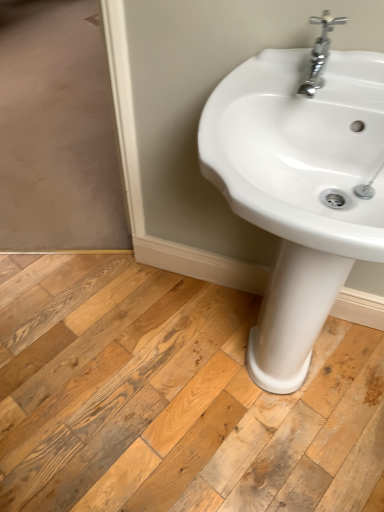
Question: Is chrome metallic faucet at upper right to the left or to the right of natural wood floor at center in the image?

Choices:
 (A) left
 (B) right

Answer: (B)

Question: From a real-world perspective, is chrome metallic faucet at upper right positioned above or below natural wood floor at center?

Choices:
 (A) above
 (B) below

Answer: (A)

Question: Which of these objects is positioned farthest from the chrome metallic faucet at upper right?

Choices:
 (A) white glossy sink at center
 (B) natural wood floor at center

Answer: (B)

Question: Which object is the closest to the white glossy sink at center?

Choices:
 (A) chrome metallic faucet at upper right
 (B) natural wood floor at center

Answer: (A)